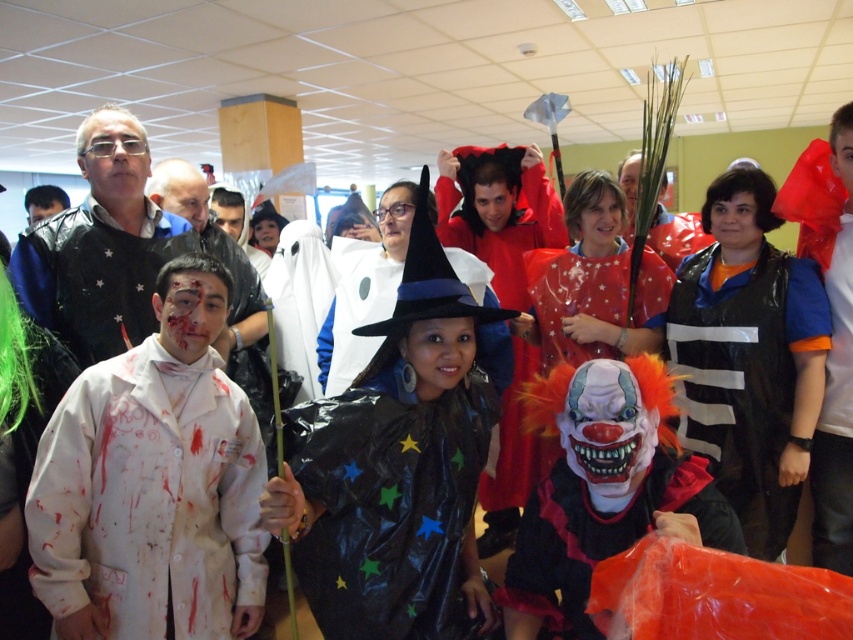
You are a photographer setting up for a group photo. You need to position the white matte lab coat at left and the rubber clown mask at center so that they are aligned properly. According to the current setup, which object is positioned to the left of the other?

The white matte lab coat at left is to the left of the rubber clown mask at center.

You are a photographer positioned at the back of the room. You want to take a photo of the white matte lab coat at left and the rubber clown mask at center. Which object is closer to the camera?

The white matte lab coat at left is closer to the camera because the rubber clown mask at center is behind it.

You are standing at the center of the image. There is a shiny black cape at center. What is located at the point with coordinates (396, 467)?

The shiny black cape at center is located at point (396, 467).